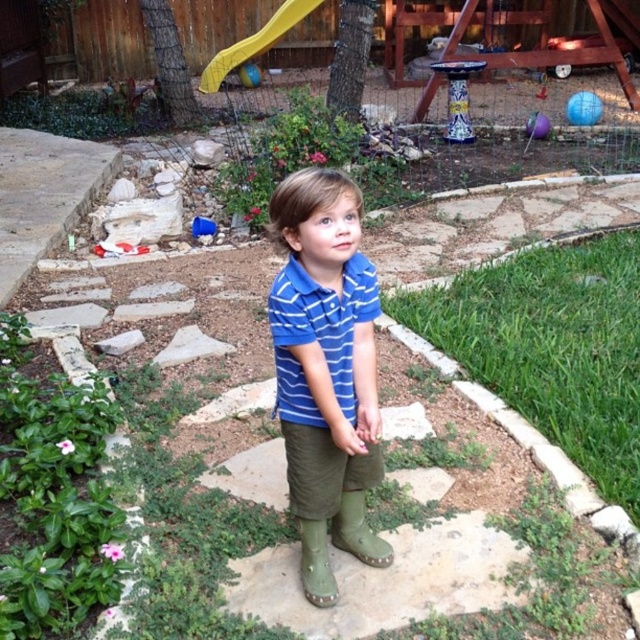
Question: Can you confirm if green grass at lower right is bigger than green rubber boot at lower center?

Choices:
 (A) no
 (B) yes

Answer: (B)

Question: Estimate the real-world distances between objects in this image. Which object is closer to the green grass at lower right?

Choices:
 (A) green rubber boot at lower center
 (B) blue striped polo shirt at center

Answer: (A)

Question: Is green grass at lower right below blue striped polo shirt at center?

Choices:
 (A) no
 (B) yes

Answer: (A)

Question: Which point is closer to the camera?

Choices:
 (A) green rubber boot at lower center
 (B) green rubber boot at center
 (C) blue striped polo shirt at center

Answer: (C)

Question: Based on their relative distances, which object is nearer to the green rubber boot at center?

Choices:
 (A) blue striped shirt at center
 (B) green grass at lower right

Answer: (A)

Question: Is blue striped polo shirt at center to the right of green rubber boot at lower center from the viewer's perspective?

Choices:
 (A) no
 (B) yes

Answer: (B)